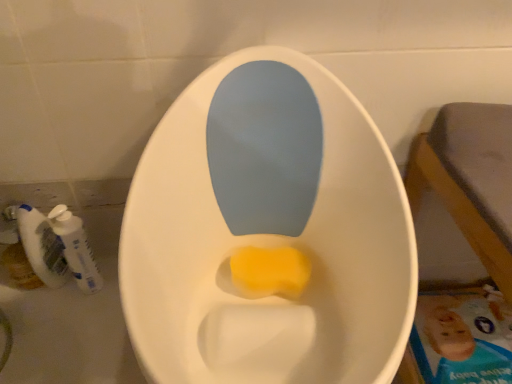
In order to face white plastic mouthwash at lower left, which appears as the second mouthwash when viewed from the right, should I rotate leftwards or rightwards?

Rotate your view left by about 26.881°.

Image resolution: width=512 pixels, height=384 pixels. Describe the element at coordinates (270, 271) in the screenshot. I see `yellow sponge at center` at that location.

Find the location of `white plastic mouthwash at lower left, which is counted as the first mouthwash, starting from the left`. white plastic mouthwash at lower left, which is counted as the first mouthwash, starting from the left is located at coordinates (42, 246).

From the image's perspective, which object appears higher, yellow sponge at center or white plastic mouthwash at lower left, which is counted as the first mouthwash, starting from the left?

white plastic mouthwash at lower left, which is counted as the first mouthwash, starting from the left, from the image's perspective.

Who is shorter, yellow sponge at center or white plastic mouthwash at lower left, which appears as the second mouthwash when viewed from the right?

With less height is yellow sponge at center.

Measure the distance from yellow sponge at center to white plastic mouthwash at lower left, which appears as the second mouthwash when viewed from the right.

yellow sponge at center is 18.61 inches from white plastic mouthwash at lower left, which appears as the second mouthwash when viewed from the right.

Is yellow sponge at center touching white plastic mouthwash at lower left, which appears as the second mouthwash when viewed from the right?

No.

Between white plastic mouthwash at lower left, which appears as the second mouthwash when viewed from the right, and white plastic mouthwash at left, the 2th mouthwash when ordered from left to right, which one has larger width?

Wider between the two is white plastic mouthwash at left, the 2th mouthwash when ordered from left to right.

Consider the image. Is white plastic mouthwash at lower left, which is counted as the first mouthwash, starting from the left, at the right side of white plastic mouthwash at left, the 2th mouthwash when ordered from left to right?

In fact, white plastic mouthwash at lower left, which is counted as the first mouthwash, starting from the left, is to the left of white plastic mouthwash at left, the 2th mouthwash when ordered from left to right.

Is white plastic mouthwash at lower left, which is counted as the first mouthwash, starting from the left, in front of or behind white plastic mouthwash at left, the 2th mouthwash when ordered from left to right, in the image?

Visually, white plastic mouthwash at lower left, which is counted as the first mouthwash, starting from the left, is located behind white plastic mouthwash at left, the 2th mouthwash when ordered from left to right.

Looking at the image, does white plastic mouthwash at lower left, which appears as the second mouthwash when viewed from the right, seem bigger or smaller compared to white plastic mouthwash at left, which is counted as the first mouthwash, starting from the right?

In the image, white plastic mouthwash at lower left, which appears as the second mouthwash when viewed from the right, appears to be smaller than white plastic mouthwash at left, which is counted as the first mouthwash, starting from the right.

From a real-world perspective, is white plastic mouthwash at left, which is counted as the first mouthwash, starting from the right, located higher than white plastic mouthwash at lower left, which appears as the second mouthwash when viewed from the right?

No, from a real-world perspective, white plastic mouthwash at left, which is counted as the first mouthwash, starting from the right, is not on top of white plastic mouthwash at lower left, which appears as the second mouthwash when viewed from the right.

Does white plastic mouthwash at left, which is counted as the first mouthwash, starting from the right, have a larger size compared to white plastic mouthwash at lower left, which appears as the second mouthwash when viewed from the right?

Indeed, white plastic mouthwash at left, which is counted as the first mouthwash, starting from the right, has a larger size compared to white plastic mouthwash at lower left, which appears as the second mouthwash when viewed from the right.

Consider the image. Could white plastic mouthwash at lower left, which appears as the second mouthwash when viewed from the right, be considered to be inside white plastic mouthwash at left, the 2th mouthwash when ordered from left to right?

Actually, white plastic mouthwash at lower left, which appears as the second mouthwash when viewed from the right, is outside white plastic mouthwash at left, the 2th mouthwash when ordered from left to right.

Considering the relative sizes of white plastic mouthwash at left, which is counted as the first mouthwash, starting from the right, and white plastic mouthwash at lower left, which is counted as the first mouthwash, starting from the left, in the image provided, is white plastic mouthwash at left, which is counted as the first mouthwash, starting from the right, wider than white plastic mouthwash at lower left, which is counted as the first mouthwash, starting from the left,?

Yes, white plastic mouthwash at left, which is counted as the first mouthwash, starting from the right, is wider than white plastic mouthwash at lower left, which is counted as the first mouthwash, starting from the left.

Is white plastic mouthwash at lower left, which is counted as the first mouthwash, starting from the left, to the left or to the right of yellow sponge at center in the image?

Clearly, white plastic mouthwash at lower left, which is counted as the first mouthwash, starting from the left, is on the left of yellow sponge at center in the image.

Which object is more forward, white plastic mouthwash at lower left, which is counted as the first mouthwash, starting from the left, or yellow sponge at center?

Positioned in front is yellow sponge at center.

Is point (49, 279) behind point (251, 289)?

Yes, it is behind point (251, 289).

I want to click on the 2nd mouthwash behind when counting from the yellow sponge at center, so click(x=42, y=246).

Which is more to the right, white plastic mouthwash at left, which is counted as the first mouthwash, starting from the right, or yellow sponge at center?

yellow sponge at center is more to the right.

Is white plastic mouthwash at left, the 2th mouthwash when ordered from left to right, thinner than yellow sponge at center?

Correct, the width of white plastic mouthwash at left, the 2th mouthwash when ordered from left to right, is less than that of yellow sponge at center.

From a real-world perspective, who is located higher, white plastic mouthwash at left, which is counted as the first mouthwash, starting from the right, or yellow sponge at center?

yellow sponge at center is physically above.

From their relative heights in the image, would you say white plastic mouthwash at left, which is counted as the first mouthwash, starting from the right, is taller or shorter than yellow sponge at center?

Clearly, white plastic mouthwash at left, which is counted as the first mouthwash, starting from the right, is taller compared to yellow sponge at center.

Is yellow sponge at center not close to white plastic mouthwash at left, which is counted as the first mouthwash, starting from the right?

No, yellow sponge at center is not far from white plastic mouthwash at left, which is counted as the first mouthwash, starting from the right.

From the image's perspective, is yellow sponge at center above or below white plastic mouthwash at left, which is counted as the first mouthwash, starting from the right?

yellow sponge at center is situated lower than white plastic mouthwash at left, which is counted as the first mouthwash, starting from the right, in the image.

Is yellow sponge at center facing towards white plastic mouthwash at left, which is counted as the first mouthwash, starting from the right?

No, yellow sponge at center is not oriented towards white plastic mouthwash at left, which is counted as the first mouthwash, starting from the right.

Does yellow sponge at center come behind white plastic mouthwash at left, which is counted as the first mouthwash, starting from the right?

No.

From a real-world perspective, starting from the yellow sponge at center, which mouthwash is the 1st one below it? Please provide its 2D coordinates.

[(42, 246)]

Identify the location of mouthwash on the right of white plastic mouthwash at lower left, which appears as the second mouthwash when viewed from the right. This screenshot has height=384, width=512. (75, 248).

Looking at the image, which one is located further to white plastic mouthwash at lower left, which appears as the second mouthwash when viewed from the right, yellow sponge at center or white plastic mouthwash at left, the 2th mouthwash when ordered from left to right?

yellow sponge at center is further to white plastic mouthwash at lower left, which appears as the second mouthwash when viewed from the right.

Considering their positions, is white plastic mouthwash at left, the 2th mouthwash when ordered from left to right, positioned closer to white plastic mouthwash at lower left, which appears as the second mouthwash when viewed from the right, than yellow sponge at center?

white plastic mouthwash at left, the 2th mouthwash when ordered from left to right, is closer to white plastic mouthwash at lower left, which appears as the second mouthwash when viewed from the right.

From the image, which object appears to be farther from yellow sponge at center, white plastic mouthwash at left, which is counted as the first mouthwash, starting from the right, or white plastic mouthwash at lower left, which is counted as the first mouthwash, starting from the left?

The object further to yellow sponge at center is white plastic mouthwash at lower left, which is counted as the first mouthwash, starting from the left.

Looking at the image, which one is located closer to white plastic mouthwash at left, the 2th mouthwash when ordered from left to right, yellow sponge at center or white plastic mouthwash at lower left, which is counted as the first mouthwash, starting from the left?

white plastic mouthwash at lower left, which is counted as the first mouthwash, starting from the left, is positioned closer to the anchor white plastic mouthwash at left, the 2th mouthwash when ordered from left to right.

Estimate the real-world distances between objects in this image. Which object is closer to yellow sponge at center, white plastic mouthwash at lower left, which appears as the second mouthwash when viewed from the right, or white plastic mouthwash at left, the 2th mouthwash when ordered from left to right?

white plastic mouthwash at left, the 2th mouthwash when ordered from left to right, is closer to yellow sponge at center.

When comparing their distances from white plastic mouthwash at left, the 2th mouthwash when ordered from left to right, does white plastic mouthwash at lower left, which is counted as the first mouthwash, starting from the left, or yellow sponge at center seem closer?

white plastic mouthwash at lower left, which is counted as the first mouthwash, starting from the left, is positioned closer to the anchor white plastic mouthwash at left, the 2th mouthwash when ordered from left to right.

Identify the location of mouthwash situated between white plastic mouthwash at lower left, which appears as the second mouthwash when viewed from the right, and yellow sponge at center from left to right. This screenshot has height=384, width=512. (75, 248).